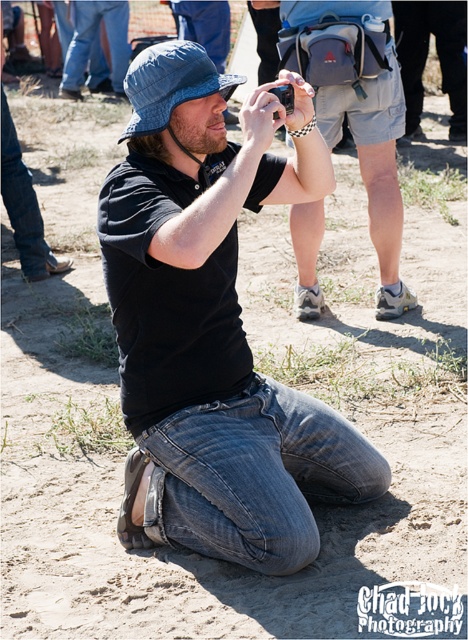
What are the exact coordinates of the black matte camera at center in the image?

The black matte camera at center is located at coordinates point (213, 324).

You are trying to decide which camera to use for a photography session. Both the matte black camera at center and the black plastic camera at center are available. Which one is bigger?

The matte black camera at center is larger in size compared to the black plastic camera at center.